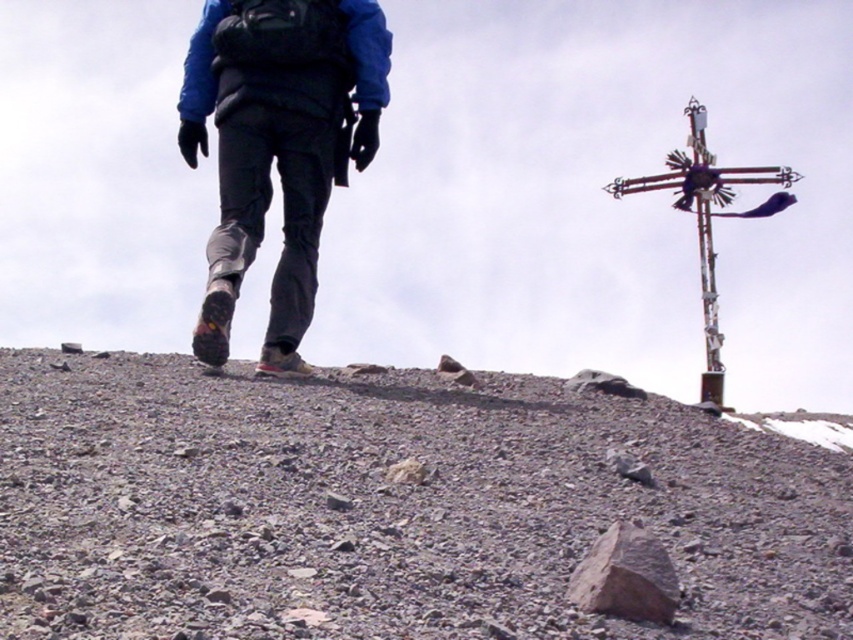
Question: Does matte black pants at center come behind brown rough rock at lower center?

Choices:
 (A) no
 (B) yes

Answer: (B)

Question: Which is nearer to the matte black pants at center?

Choices:
 (A) brown rough rock at lower center
 (B) rusty metal cross at upper right
 (C) gray gravel at upper center

Answer: (C)

Question: Does rusty metal cross at upper right appear under brown rough rock at lower center?

Choices:
 (A) no
 (B) yes

Answer: (A)

Question: Which point is farther from the camera taking this photo?

Choices:
 (A) (711, 516)
 (B) (355, 8)

Answer: (B)

Question: Which object appears farthest from the camera in this image?

Choices:
 (A) matte black pants at center
 (B) rusty metal cross at upper right

Answer: (B)

Question: Is gray gravel at upper center above matte black pants at center?

Choices:
 (A) no
 (B) yes

Answer: (A)